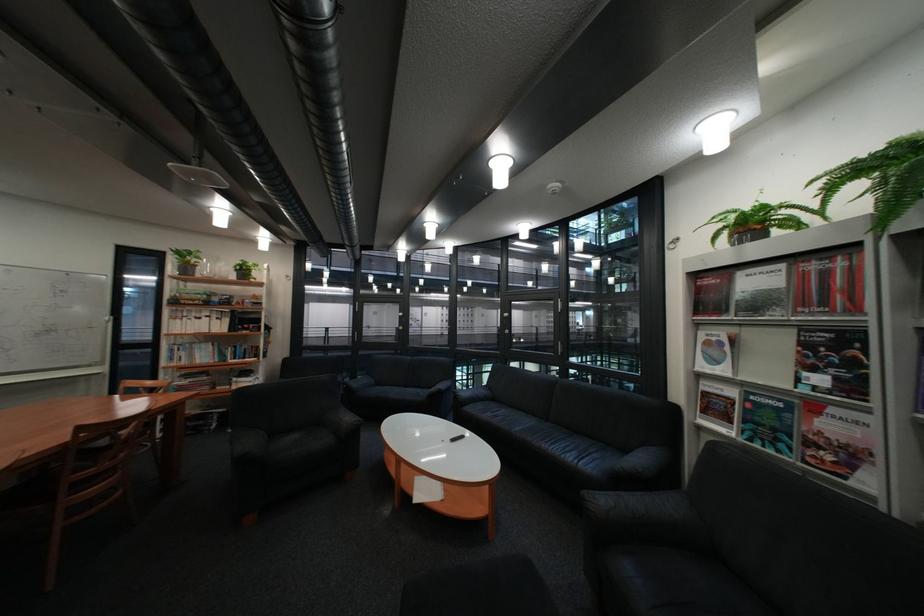
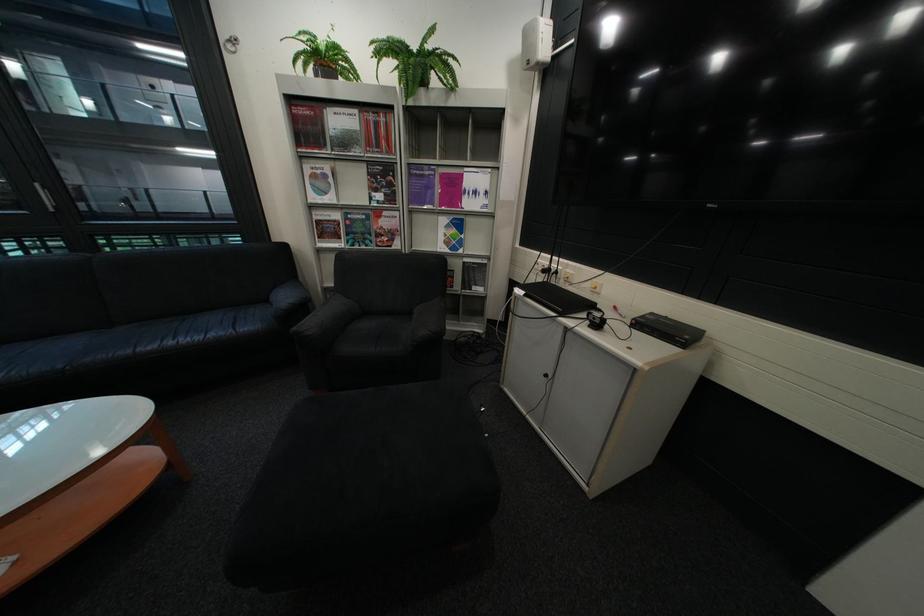
In the second image, find the point that corresponds to point 748,245 in the first image.

(333, 78)